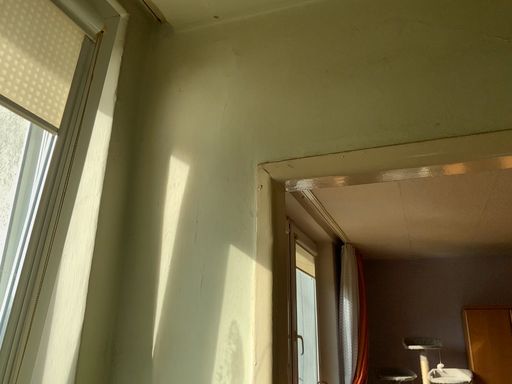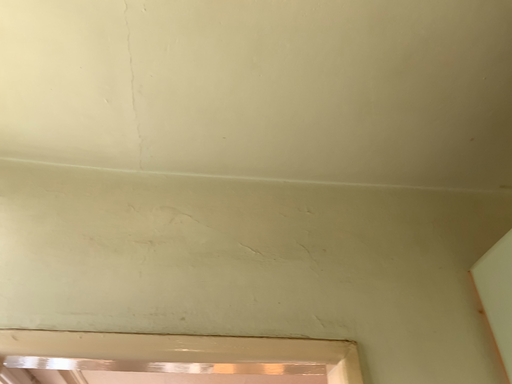
Question: Which way did the camera rotate in the video?

Choices:
 (A) rotated left
 (B) rotated right

Answer: (B)